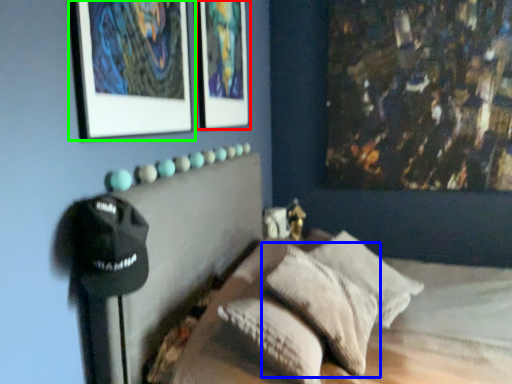
Question: Considering the real-world distances, which object is closest to picture frame (highlighted by a red box)? pillow (highlighted by a blue box) or picture frame (highlighted by a green box).

Choices:
 (A) pillow
 (B) picture frame

Answer: (B)